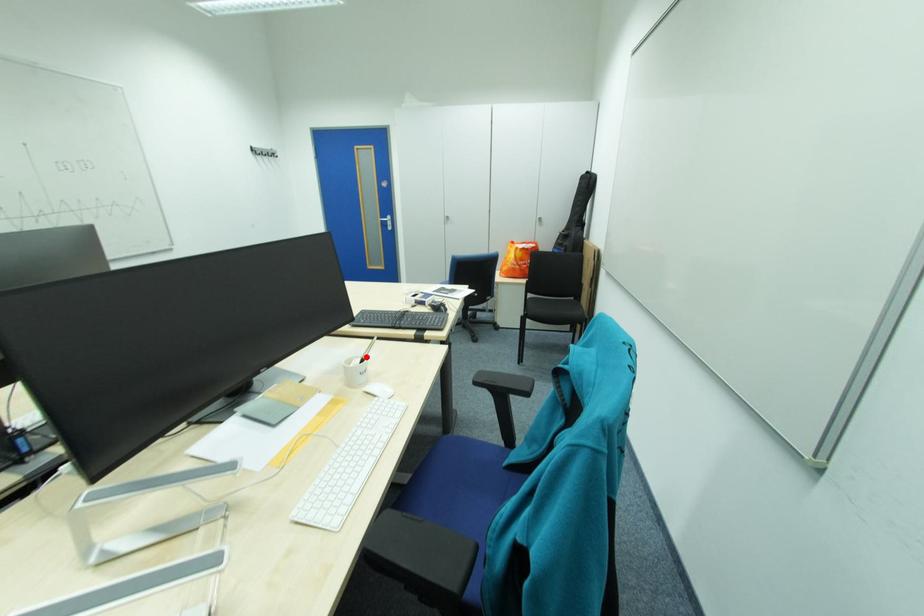
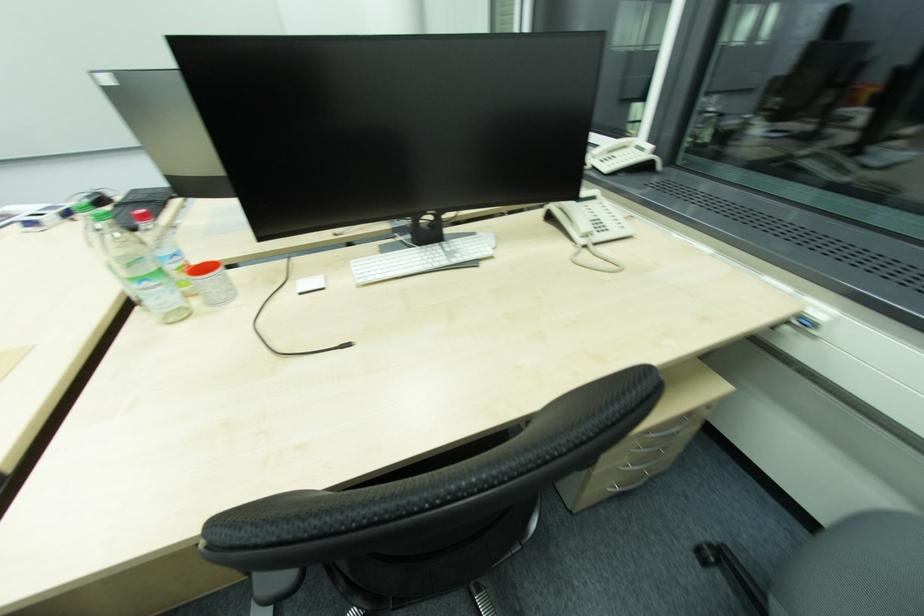
Question: I am providing you with two images of the same scene from different viewpoints. A red point is marked on the first image. Can you still see the location of the red point in image 2?

Choices:
 (A) Yes
 (B) No

Answer: (B)